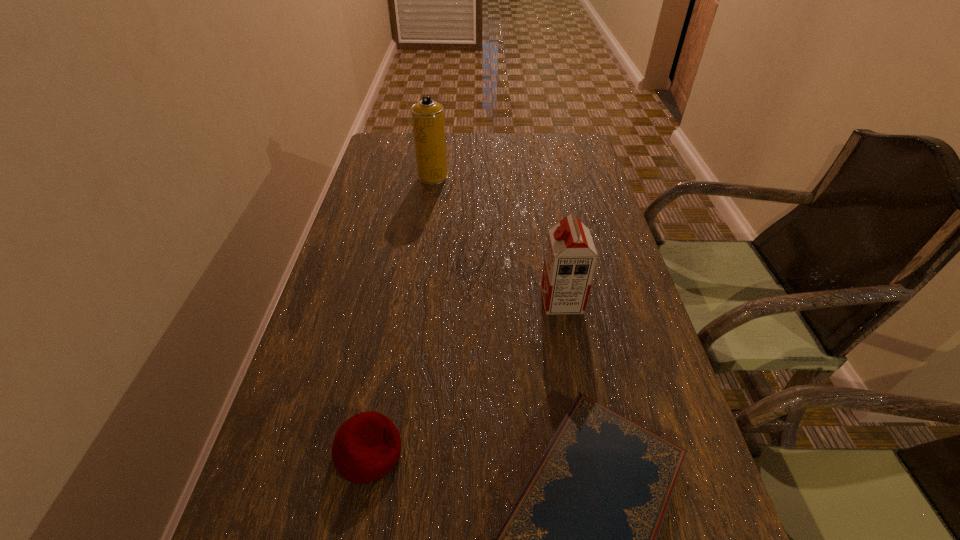
Identify the location of vacant space at the right edge of the desktop. (599, 320).

The width and height of the screenshot is (960, 540). Find the location of `blank area at the far right corner`. blank area at the far right corner is located at coordinates (568, 148).

Locate an element on the screen. The width and height of the screenshot is (960, 540). vacant point located between the farthest object and the soya milk is located at coordinates (497, 239).

Find the location of a particular element. This screenshot has height=540, width=960. unoccupied area between the beanbag and the second farthest object is located at coordinates (466, 376).

Where is `free space that is in between the farthest object and the soya milk`? Image resolution: width=960 pixels, height=540 pixels. free space that is in between the farthest object and the soya milk is located at coordinates (497, 239).

What are the coordinates of `empty location between the farthest object and the second shortest object` in the screenshot? It's located at (401, 314).

Where is `vacant space that is in between the aerosol can and the second shortest object`? The image size is (960, 540). vacant space that is in between the aerosol can and the second shortest object is located at coordinates (401, 314).

What are the coordinates of `object that is the closest one to the shortest object` in the screenshot? It's located at (367, 446).

The height and width of the screenshot is (540, 960). What are the coordinates of `object that ranks as the third closest to the soya milk` in the screenshot? It's located at (427, 115).

This screenshot has height=540, width=960. In order to click on free space in the image that satisfies the following two spatial constraints: 1. on the front side of the aerosol can; 2. on the right side of the third nearest object in this screenshot , I will do `click(416, 300)`.